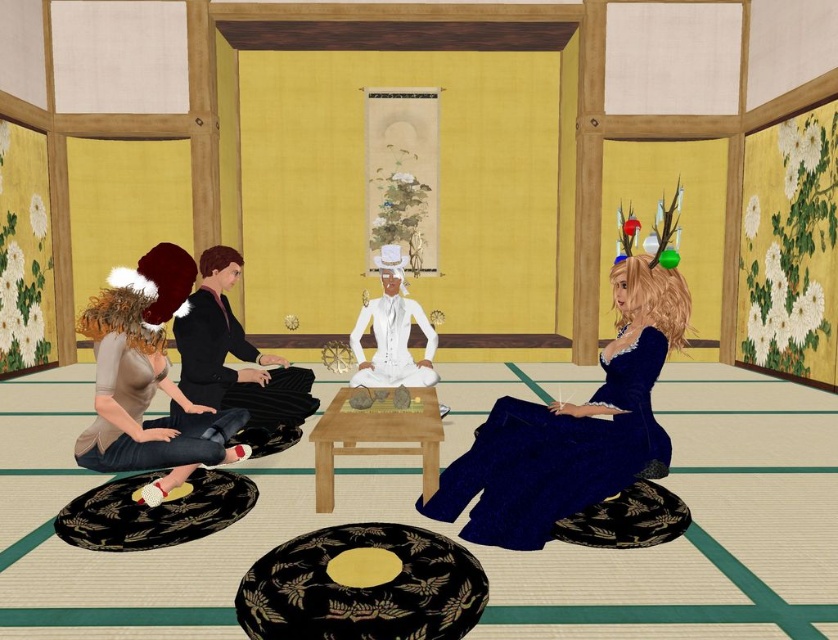
Can you confirm if matte brown hair at left is positioned to the right of white satin suit at center?

In fact, matte brown hair at left is to the left of white satin suit at center.

Does matte brown hair at left have a larger size compared to white satin suit at center?

No, matte brown hair at left is not bigger than white satin suit at center.

Between point (190, 417) and point (378, 355), which one is positioned in front?

Point (190, 417)

This screenshot has height=640, width=838. What are the coordinates of `matte brown hair at left` in the screenshot? It's located at (148, 380).

Which is below, navy satin dress at lower right or matte brown hair at left?

navy satin dress at lower right

Does navy satin dress at lower right appear on the right side of matte brown hair at left?

Indeed, navy satin dress at lower right is positioned on the right side of matte brown hair at left.

Describe the element at coordinates (568, 465) in the screenshot. I see `navy satin dress at lower right` at that location.

Where is `navy satin dress at lower right`? navy satin dress at lower right is located at coordinates (568, 465).

Which is above, navy satin dress at lower right or matte beige dress at lower left?

matte beige dress at lower left

Is navy satin dress at lower right closer to camera compared to matte beige dress at lower left?

That is True.

Where is `navy satin dress at lower right`? Image resolution: width=838 pixels, height=640 pixels. navy satin dress at lower right is located at coordinates (568, 465).

The height and width of the screenshot is (640, 838). What are the coordinates of `navy satin dress at lower right` in the screenshot? It's located at (568, 465).